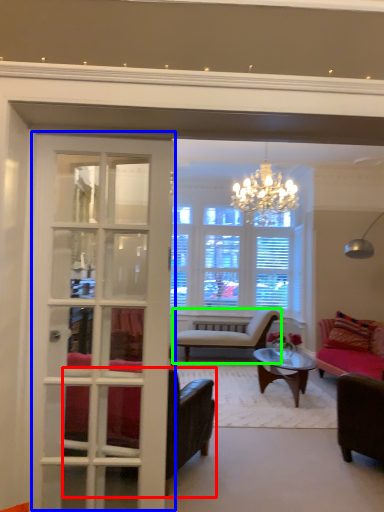
Question: Which object is positioned farthest from chair (highlighted by a red box)? Select from door (highlighted by a blue box) and chair (highlighted by a green box).

Choices:
 (A) door
 (B) chair

Answer: (B)